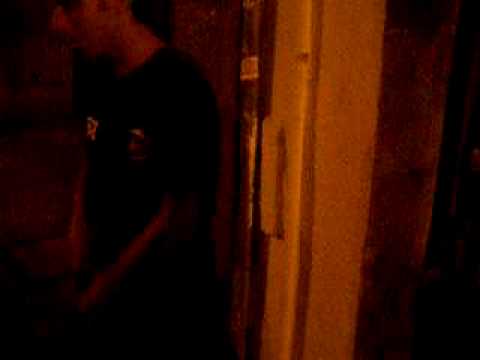
Locate an element on the screen. This screenshot has height=360, width=480. door is located at coordinates (314, 226).